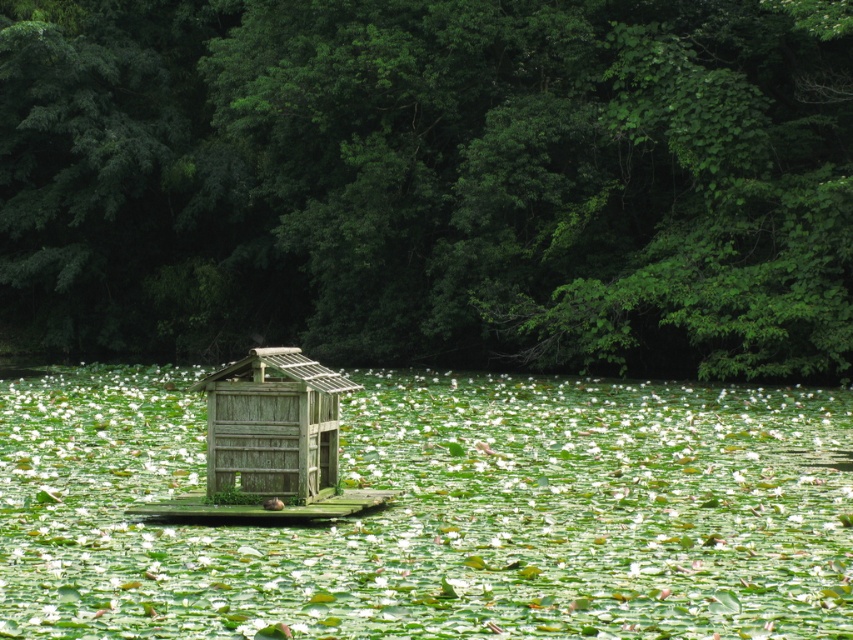
Locate an element on the screen. green leafy trees at center is located at coordinates (431, 180).

From the picture: Who is positioned more to the right, green leafy trees at center or weathered wood hut at center?

weathered wood hut at center is more to the right.

This screenshot has width=853, height=640. I want to click on green leafy trees at center, so pos(431,180).

This screenshot has width=853, height=640. Identify the location of green leafy trees at center. click(431, 180).

Which is above, green leafy trees at center or green leafy water at center?

Positioned higher is green leafy trees at center.

How much distance is there between green leafy trees at center and green leafy water at center?

green leafy trees at center is 8.43 meters from green leafy water at center.

Measure the distance between point (51, 269) and camera.

The distance of point (51, 269) from camera is 165.43 feet.

Locate an element on the screen. The image size is (853, 640). green leafy trees at center is located at coordinates (431, 180).

Is point (163, 385) closer to camera compared to point (254, 394)?

No, it is behind (254, 394).

Who is shorter, green leafy water at center or weathered wood hut at center?

green leafy water at center

Which is in front, point (41, 534) or point (286, 470)?

Positioned in front is point (41, 534).

The height and width of the screenshot is (640, 853). What are the coordinates of `green leafy water at center` in the screenshot? It's located at (438, 513).